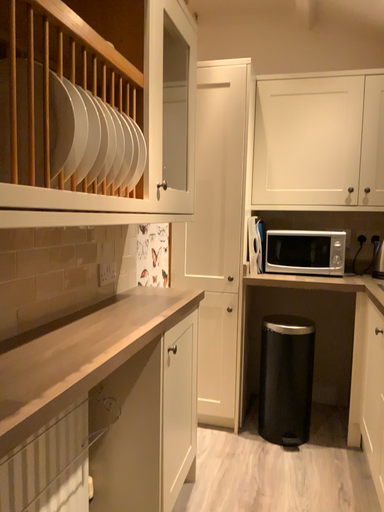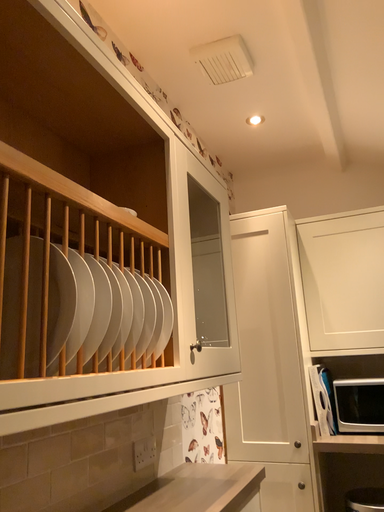
Question: How did the camera likely rotate when shooting the video?

Choices:
 (A) rotated left
 (B) rotated right

Answer: (A)